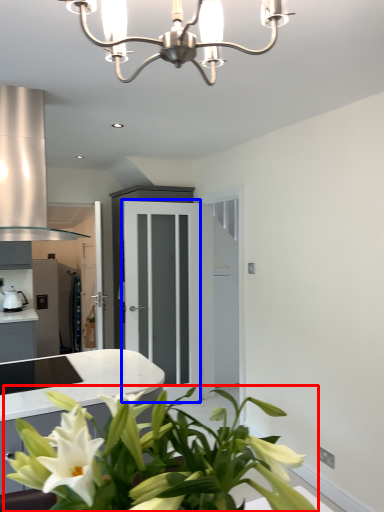
Question: Among these objects, which one is farthest to the camera, houseplant (highlighted by a red box) or glass door (highlighted by a blue box)?

Choices:
 (A) houseplant
 (B) glass door

Answer: (B)